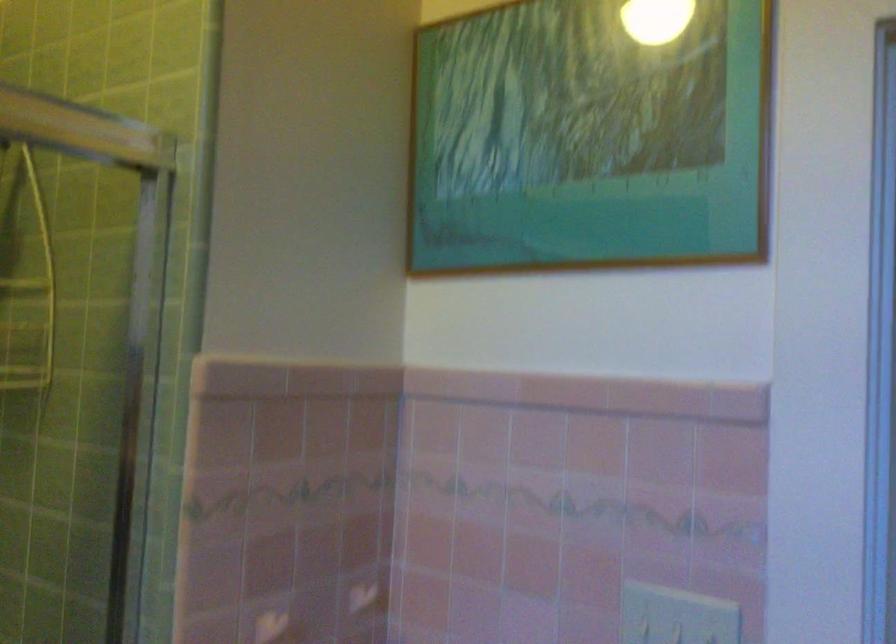
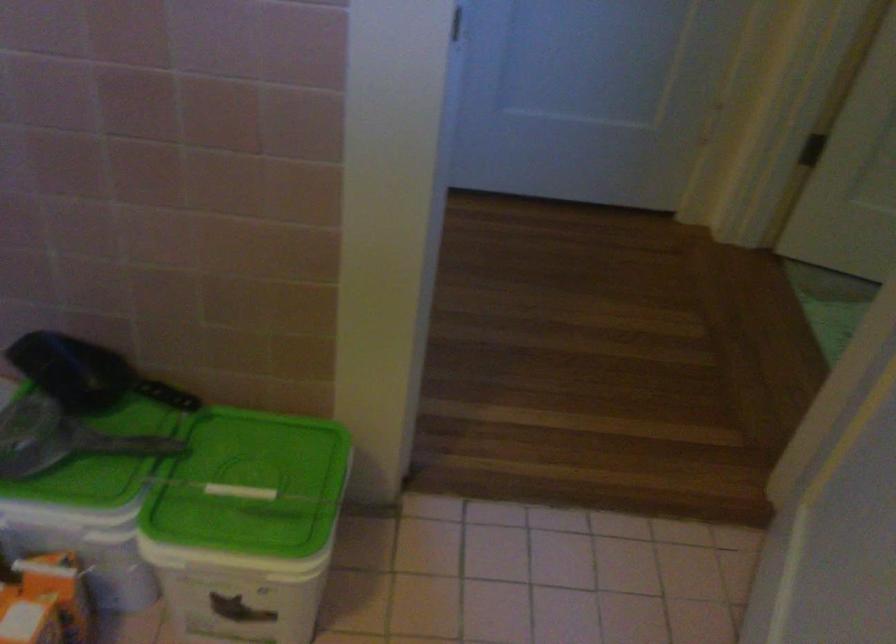
How did the camera likely rotate?

The camera's rotation is toward right-down.